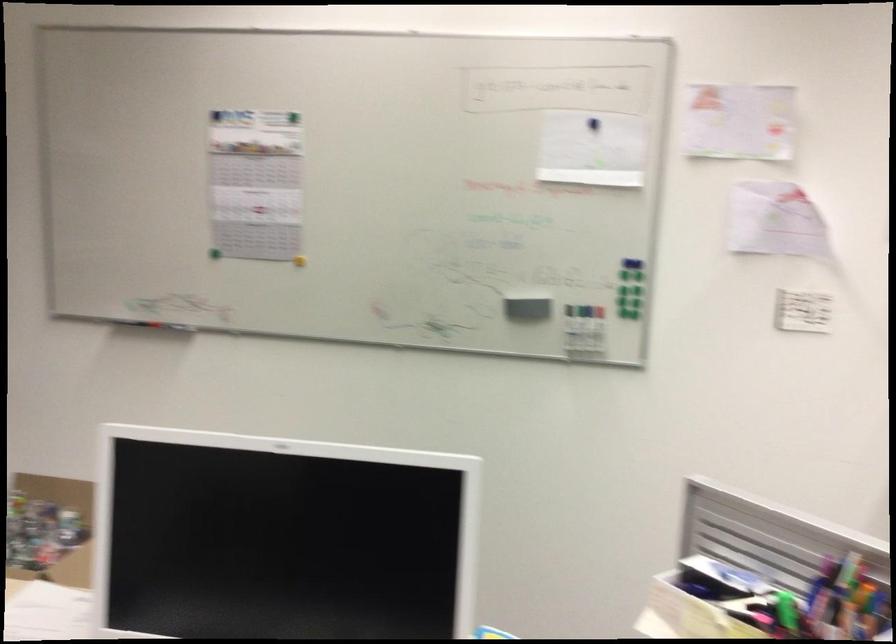
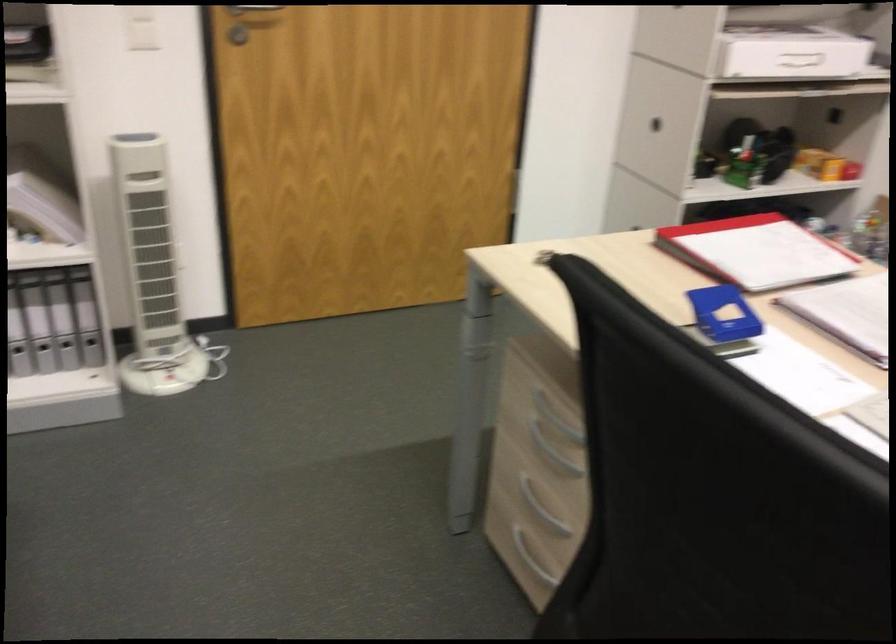
First-person continuous shooting, in which direction is the camera rotating?

The camera rotated toward left-down.